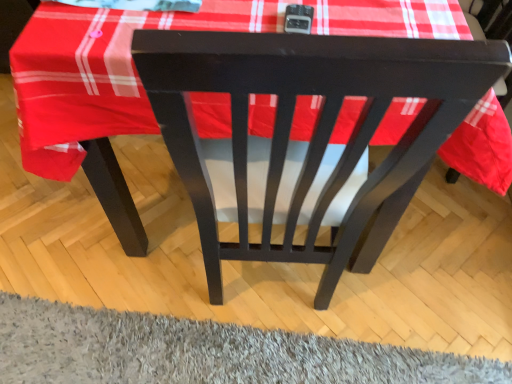
Question: Should I look upward or downward to see matte black chair at center?

Choices:
 (A) down
 (B) up

Answer: (B)

Question: Is matte black chair at center at the back of gray shaggy rug at lower center?

Choices:
 (A) no
 (B) yes

Answer: (B)

Question: Considering the relative sizes of gray shaggy rug at lower center and matte black chair at center in the image provided, is gray shaggy rug at lower center taller than matte black chair at center?

Choices:
 (A) no
 (B) yes

Answer: (A)

Question: Can you confirm if gray shaggy rug at lower center is thinner than matte black chair at center?

Choices:
 (A) yes
 (B) no

Answer: (A)

Question: Considering the relative sizes of gray shaggy rug at lower center and matte black chair at center in the image provided, is gray shaggy rug at lower center wider than matte black chair at center?

Choices:
 (A) no
 (B) yes

Answer: (A)

Question: Would you say gray shaggy rug at lower center is outside matte black chair at center?

Choices:
 (A) no
 (B) yes

Answer: (A)

Question: From a real-world perspective, does gray shaggy rug at lower center sit lower than matte black chair at center?

Choices:
 (A) no
 (B) yes

Answer: (A)

Question: Would you say matte black chair at center contains gray shaggy rug at lower center?

Choices:
 (A) no
 (B) yes

Answer: (B)

Question: Does matte black chair at center have a greater height compared to gray shaggy rug at lower center?

Choices:
 (A) yes
 (B) no

Answer: (A)

Question: Does matte black chair at center have a larger size compared to gray shaggy rug at lower center?

Choices:
 (A) yes
 (B) no

Answer: (A)

Question: Does matte black chair at center appear on the right side of gray shaggy rug at lower center?

Choices:
 (A) yes
 (B) no

Answer: (B)

Question: Is matte black chair at center completely or partially outside of gray shaggy rug at lower center?

Choices:
 (A) yes
 (B) no

Answer: (A)

Question: Is matte black chair at center positioned before gray shaggy rug at lower center?

Choices:
 (A) yes
 (B) no

Answer: (B)

Question: Considering the positions of gray shaggy rug at lower center and matte black chair at center in the image, is gray shaggy rug at lower center bigger or smaller than matte black chair at center?

Choices:
 (A) big
 (B) small

Answer: (B)